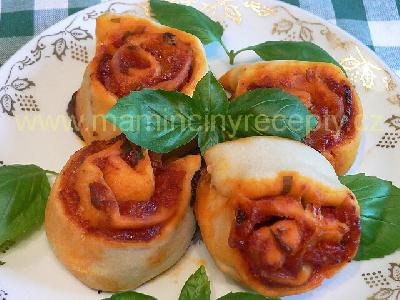
Where is `plate`? plate is located at coordinates (394, 161), (34, 130).